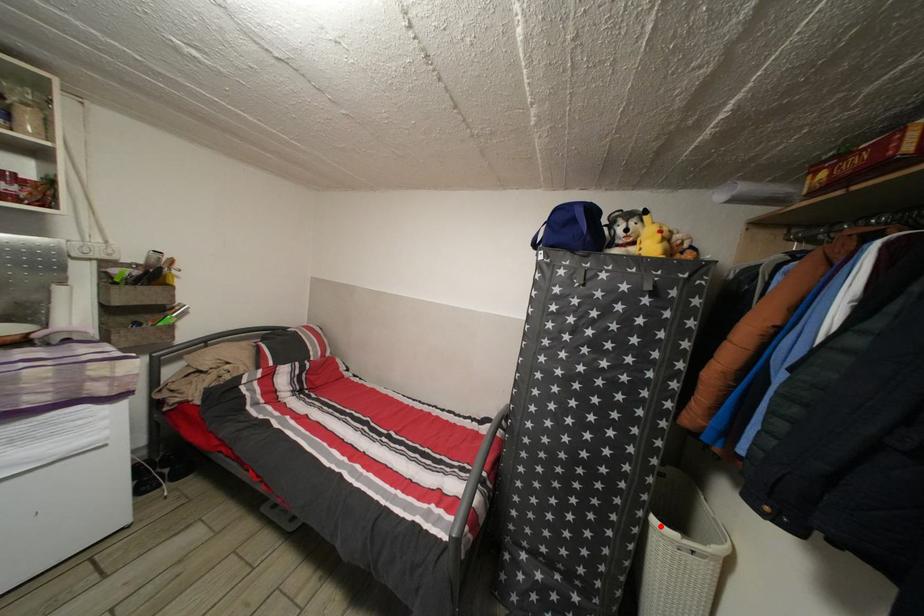
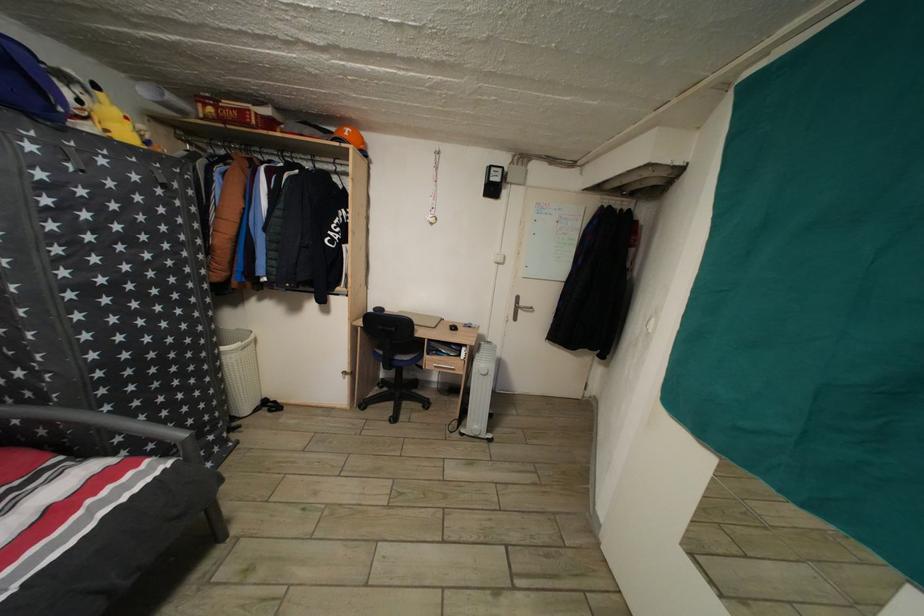
The point at the highlighted location is marked in the first image. Where is the corresponding point in the second image?

(229, 355)